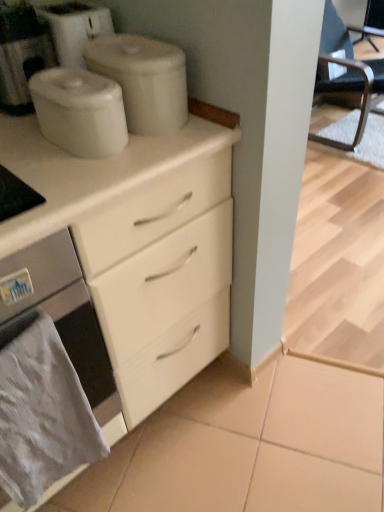
Question: From the image's perspective, is white matte containers at upper center, the second appliance when ordered from front to back, located beneath black leather chair at right?

Choices:
 (A) no
 (B) yes

Answer: (B)

Question: Can you confirm if white matte containers at upper center, the 1th appliance viewed from the back, is taller than black leather chair at right?

Choices:
 (A) no
 (B) yes

Answer: (A)

Question: Is white matte containers at upper center, the 1th appliance viewed from the back, positioned before black leather chair at right?

Choices:
 (A) yes
 (B) no

Answer: (A)

Question: Does white matte containers at upper center, the second appliance when ordered from front to back, turn towards black leather chair at right?

Choices:
 (A) no
 (B) yes

Answer: (A)

Question: Is white matte containers at upper center, the second appliance when ordered from front to back, wider than black leather chair at right?

Choices:
 (A) yes
 (B) no

Answer: (B)

Question: From a real-world perspective, is white matte containers at upper center, the second appliance when ordered from front to back, positioned over black leather chair at right based on gravity?

Choices:
 (A) no
 (B) yes

Answer: (B)

Question: Is the surface of gray fabric towel at lower left in direct contact with white matte containers at upper center, the second appliance when ordered from front to back?

Choices:
 (A) no
 (B) yes

Answer: (A)

Question: Does gray fabric towel at lower left have a smaller size compared to white matte containers at upper center, the second appliance when ordered from front to back?

Choices:
 (A) yes
 (B) no

Answer: (B)

Question: Considering the relative sizes of gray fabric towel at lower left and white matte containers at upper center, the 1th appliance viewed from the back, in the image provided, is gray fabric towel at lower left wider than white matte containers at upper center, the 1th appliance viewed from the back,?

Choices:
 (A) no
 (B) yes

Answer: (A)

Question: Is gray fabric towel at lower left shorter than white matte containers at upper center, the second appliance when ordered from front to back?

Choices:
 (A) yes
 (B) no

Answer: (B)

Question: From a real-world perspective, is gray fabric towel at lower left on white matte containers at upper center, the second appliance when ordered from front to back?

Choices:
 (A) yes
 (B) no

Answer: (B)

Question: Is gray fabric towel at lower left bigger than white matte containers at upper center, the second appliance when ordered from front to back?

Choices:
 (A) no
 (B) yes

Answer: (B)

Question: Is gray fabric towel at lower left positioned far away from satin white oven at lower left?

Choices:
 (A) yes
 (B) no

Answer: (B)